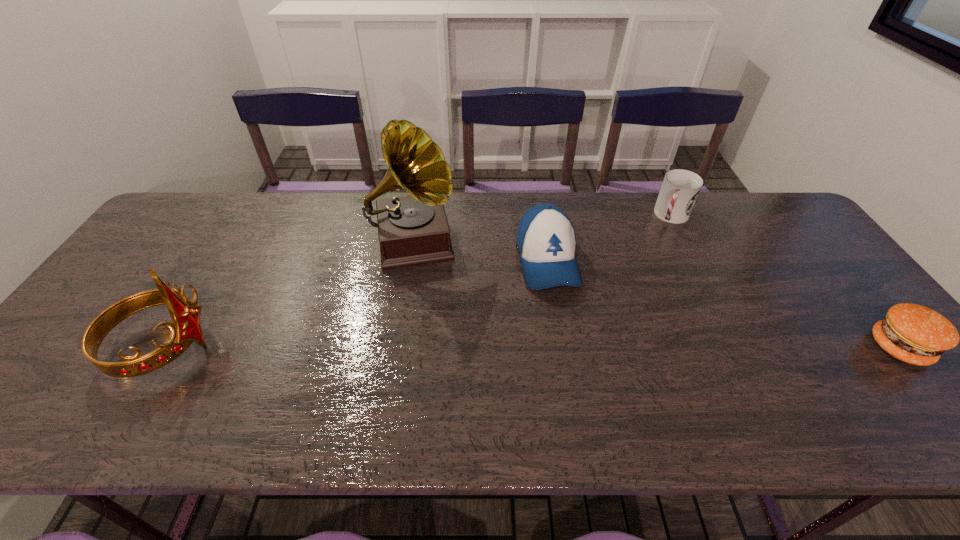
At what (x,y) coordinates should I click in order to perform the action: click on free space located on the front-facing side of the third object from right to left. Please return your answer as a coordinate pair (x, y). The width and height of the screenshot is (960, 540). Looking at the image, I should click on (570, 343).

Locate an element on the screen. The width and height of the screenshot is (960, 540). blank space located 0.210m on the front-facing side of the third object from right to left is located at coordinates (576, 364).

At what (x,y) coordinates should I click in order to perform the action: click on free region located 0.280m on the front-facing side of the third object from right to left. Please return your answer as a coordinate pair (x, y). The width and height of the screenshot is (960, 540). Looking at the image, I should click on (585, 391).

The height and width of the screenshot is (540, 960). I want to click on free space located 0.090m on the handle side of the second object from right to left, so click(x=660, y=245).

Identify the location of blank area located on the handle side of the second object from right to left. (656, 254).

Where is `vacant position located 0.290m on the handle side of the second object from right to left`? This screenshot has height=540, width=960. vacant position located 0.290m on the handle side of the second object from right to left is located at coordinates (639, 285).

This screenshot has height=540, width=960. Find the location of `free spot located 0.160m from the horn of the tallest object`. free spot located 0.160m from the horn of the tallest object is located at coordinates (424, 328).

At what (x,y) coordinates should I click in order to perform the action: click on vacant region located 0.100m from the horn of the tallest object. Please return your answer as a coordinate pair (x, y). The width and height of the screenshot is (960, 540). Looking at the image, I should click on (421, 310).

I want to click on free point located from the horn of the tallest object, so click(x=422, y=313).

In order to click on baseball cap located at the far edge in this screenshot , I will do `click(546, 240)`.